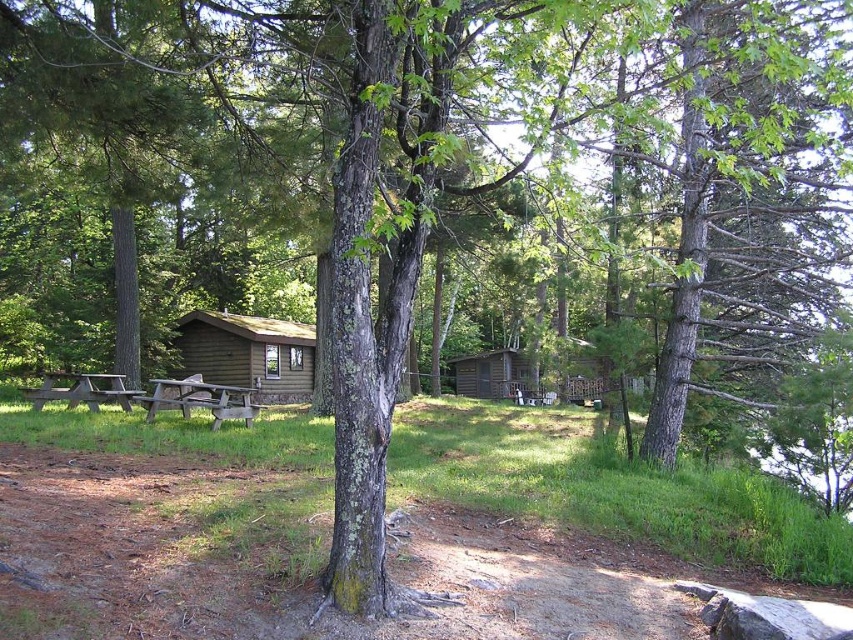
Question: Which object is positioned farthest from the brown wooden picnic table at left?

Choices:
 (A) wooden cabin at center
 (B) wooden picnic table at lower left

Answer: (A)

Question: Based on their relative distances, which object is nearer to the brown wooden picnic table at left?

Choices:
 (A) wooden picnic table at lower left
 (B) wooden cabin at center

Answer: (A)

Question: Can you confirm if wooden cabin at center is positioned above brown wooden picnic table at left?

Choices:
 (A) no
 (B) yes

Answer: (B)

Question: Can you confirm if wooden picnic table at lower left is thinner than brown wooden picnic table at left?

Choices:
 (A) yes
 (B) no

Answer: (A)

Question: Does wooden cabin at center appear over wooden picnic table at lower left?

Choices:
 (A) no
 (B) yes

Answer: (B)

Question: Which of the following is the farthest from the observer?

Choices:
 (A) tap(245, 380)
 (B) tap(79, 387)
 (C) tap(178, 385)

Answer: (A)